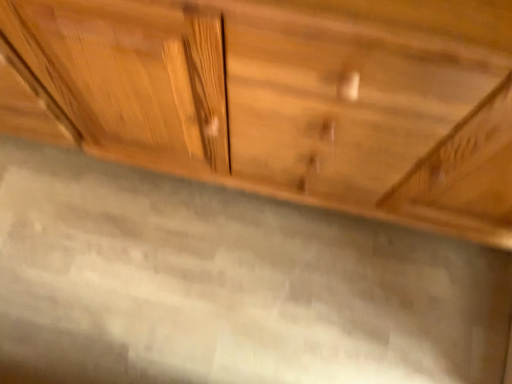
What do you see at coordinates (229, 285) in the screenshot? The image size is (512, 384). I see `gray polished granite at center` at bounding box center [229, 285].

You are a GUI agent. You are given a task and a screenshot of the screen. Output one action in this format:
    pyautogui.click(x=<x>, y=<y>)
    Task: Click on the gray polished granite at center
    The image size is (512, 384).
    Given the screenshot: What is the action you would take?
    pyautogui.click(x=229, y=285)

The height and width of the screenshot is (384, 512). Describe the element at coordinates (292, 98) in the screenshot. I see `natural wood cabinet at center` at that location.

This screenshot has width=512, height=384. In order to click on natural wood cabinet at center in this screenshot , I will do (x=292, y=98).

Locate an element on the screen. This screenshot has height=384, width=512. gray polished granite at center is located at coordinates (229, 285).

Can you confirm if gray polished granite at center is positioned to the right of natural wood cabinet at center?

In fact, gray polished granite at center is to the left of natural wood cabinet at center.

Which object is further away from the camera, gray polished granite at center or natural wood cabinet at center?

gray polished granite at center is further from the camera.

Which point is more distant from viewer, (140,257) or (357,142)?

The point (140,257) is farther.

From the image's perspective, which one is positioned higher, gray polished granite at center or natural wood cabinet at center?

natural wood cabinet at center appears higher in the image.

From a real-world perspective, which is physically above, gray polished granite at center or natural wood cabinet at center?

natural wood cabinet at center is physically above.

Considering the sizes of gray polished granite at center and natural wood cabinet at center in the image, is gray polished granite at center wider or thinner than natural wood cabinet at center?

Clearly, gray polished granite at center has more width compared to natural wood cabinet at center.

Is gray polished granite at center taller or shorter than natural wood cabinet at center?

In the image, gray polished granite at center appears to be shorter than natural wood cabinet at center.

Between gray polished granite at center and natural wood cabinet at center, which one has smaller size?

gray polished granite at center is smaller.

Would you say gray polished granite at center is inside or outside natural wood cabinet at center?

gray polished granite at center is spatially situated outside natural wood cabinet at center.

Is gray polished granite at center directly adjacent to natural wood cabinet at center?

No, gray polished granite at center is not with natural wood cabinet at center.

Is gray polished granite at center facing away from natural wood cabinet at center?

No, natural wood cabinet at center is not at the back of gray polished granite at center.

What's the angular difference between gray polished granite at center and natural wood cabinet at center's facing directions?

The angular difference between gray polished granite at center and natural wood cabinet at center is 1.33 degrees.

Locate an element on the screen. cabinetry located above the gray polished granite at center (from a real-world perspective) is located at coordinates pyautogui.click(x=292, y=98).

Considering the positions of objects natural wood cabinet at center and gray polished granite at center in the image provided, who is more to the right, natural wood cabinet at center or gray polished granite at center?

natural wood cabinet at center.

Between natural wood cabinet at center and gray polished granite at center, which one is positioned behind?

Positioned behind is gray polished granite at center.

Which point is more distant from viewer, (104, 39) or (159, 376)?

Point (159, 376)

From the image's perspective, is natural wood cabinet at center on gray polished granite at center?

Yes, from the image's perspective, natural wood cabinet at center is on top of gray polished granite at center.

From a real-world perspective, who is located lower, natural wood cabinet at center or gray polished granite at center?

gray polished granite at center.

In terms of width, does natural wood cabinet at center look wider or thinner when compared to gray polished granite at center?

Considering their sizes, natural wood cabinet at center looks slimmer than gray polished granite at center.

Between natural wood cabinet at center and gray polished granite at center, which one has more height?

Standing taller between the two is natural wood cabinet at center.

Can you confirm if natural wood cabinet at center is smaller than gray polished granite at center?

No, natural wood cabinet at center is not smaller than gray polished granite at center.

Is gray polished granite at center located within natural wood cabinet at center?

No, gray polished granite at center is located outside of natural wood cabinet at center.

Is natural wood cabinet at center positioned far away from gray polished granite at center?

No, natural wood cabinet at center is not far from gray polished granite at center.

Is natural wood cabinet at center aimed at gray polished granite at center?

Yes, natural wood cabinet at center faces towards gray polished granite at center.

Can you tell me how much natural wood cabinet at center and gray polished granite at center differ in facing direction?

The angular difference between natural wood cabinet at center and gray polished granite at center is 1.33 degrees.

How distant is natural wood cabinet at center from gray polished granite at center?

natural wood cabinet at center and gray polished granite at center are 14.49 inches apart.

Where is `granite on the left of natural wood cabinet at center`? granite on the left of natural wood cabinet at center is located at coordinates (229, 285).

Where is `granite on the left of natural wood cabinet at center`? granite on the left of natural wood cabinet at center is located at coordinates (229, 285).

Identify the location of granite behind the natural wood cabinet at center. (229, 285).